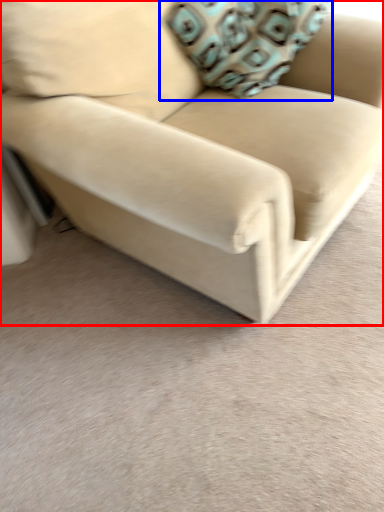
Question: Which object appears farthest to the camera in this image, studio couch (highlighted by a red box) or throw pillow (highlighted by a blue box)?

Choices:
 (A) studio couch
 (B) throw pillow

Answer: (B)